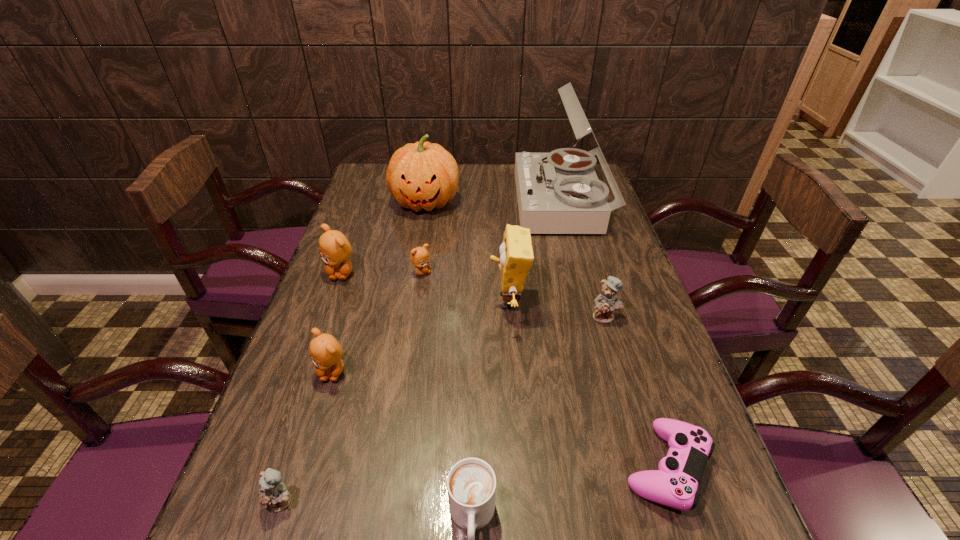
Identify the location of vacant region between the pumpkin and the control. [546, 335].

You are a GUI agent. You are given a task and a screenshot of the screen. Output one action in this format:
    pyautogui.click(x=<x>, y=<y>)
    Task: Click on the vacant area that lies between the bigger blue teddy bear and the sponge
    This screenshot has height=540, width=960.
    Given the screenshot: What is the action you would take?
    pyautogui.click(x=557, y=309)

Where is `free space between the sponge and the pumpkin`? free space between the sponge and the pumpkin is located at coordinates (467, 252).

This screenshot has height=540, width=960. I want to click on empty space between the farther blue teddy bear and the shortest object, so click(636, 392).

Where is `free space between the pink control and the third nearest teddy bear`? free space between the pink control and the third nearest teddy bear is located at coordinates tap(636, 392).

The height and width of the screenshot is (540, 960). I want to click on vacant point located between the smaller blue teddy bear and the fourth tallest object, so click(311, 387).

This screenshot has width=960, height=540. In order to click on free space between the pink control and the seventh farthest object in this screenshot , I will do `click(499, 420)`.

Locate an element on the screen. Image resolution: width=960 pixels, height=540 pixels. unoccupied position between the seventh farthest object and the control is located at coordinates (499, 420).

I want to click on the second closest object relative to the third tallest object, so click(419, 256).

Point out which object is positioned as the seventh nearest to the biggest brown teddy bear. Please provide its 2D coordinates. Your answer should be formatted as a tuple, i.e. [(x, y)], where the tuple contains the x and y coordinates of a point satisfying the conditions above.

[(471, 483)]